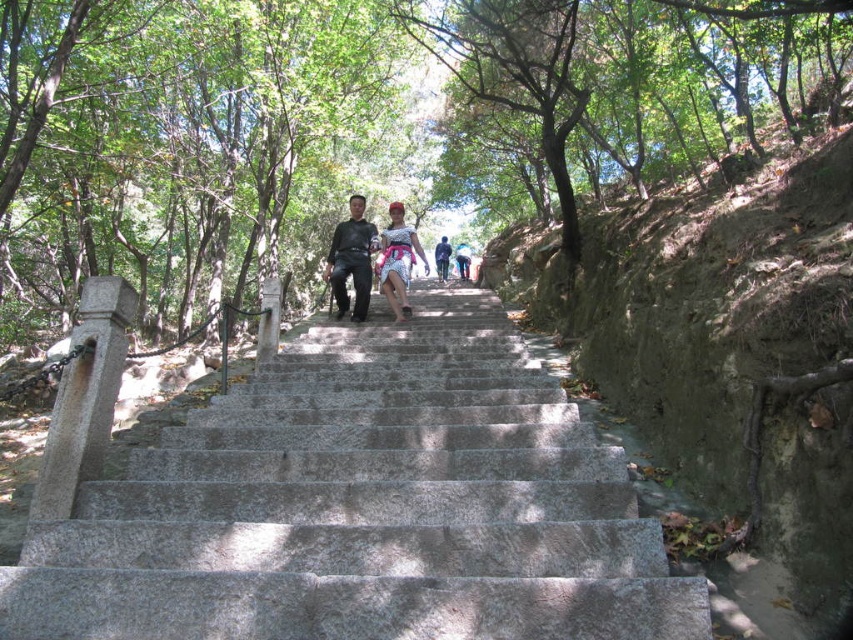
You are standing at the bottom of the stone stairs in the forest. There is a point marked at coordinates (723,346). What does this point represent?

The point at coordinates (723,346) indicates the dull gray stone stairs at center.

You are standing on the dull gray stone stairs at center and want to see the matte black dress at center. In which direction should you look?

You should look behind you because the dull gray stone stairs at center is in front of matte black dress at center, meaning the matte black dress at center is behind you.

You are a hiker who wants to know if the distance between the dark gray fabric pants at center and the white printed dress at center is enough to walk through. Can you confirm if the space between them is at least 60 centimeters?

The dark gray fabric pants at center is 65.17 centimeters away from the white printed dress at center, so yes, the space between them is more than 60 centimeters, allowing you to walk through comfortably.